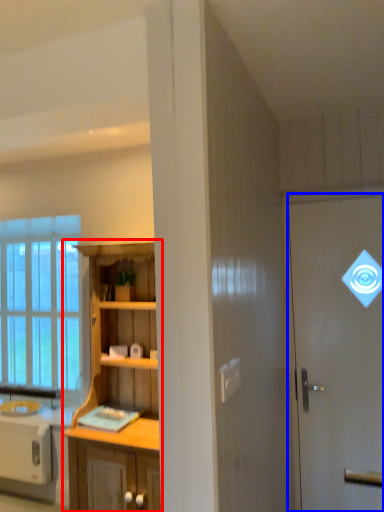
Question: Among these objects, which one is nearest to the camera, cabinetry (highlighted by a red box) or door (highlighted by a blue box)?

Choices:
 (A) cabinetry
 (B) door

Answer: (A)